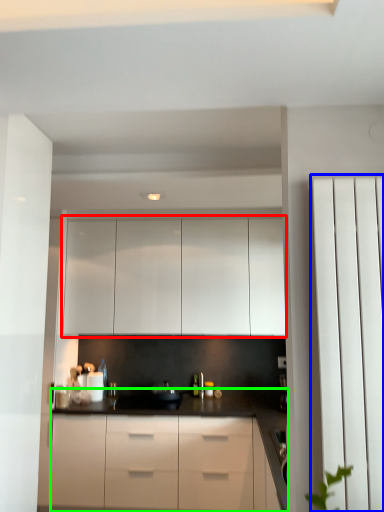
Question: Which object is the farthest from cabinetry (highlighted by a red box)? Choose among these: screen door (highlighted by a blue box) or countertop (highlighted by a green box).

Choices:
 (A) screen door
 (B) countertop

Answer: (A)